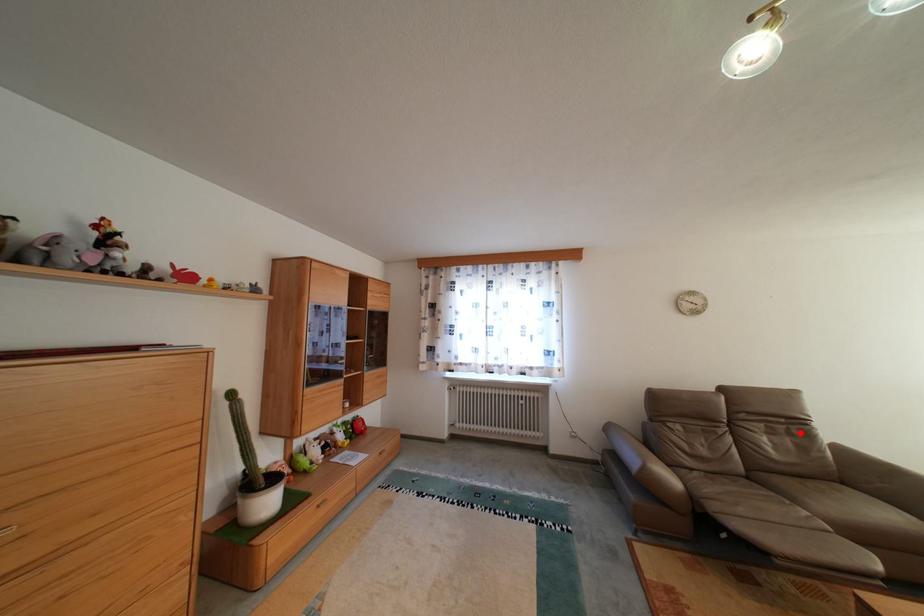
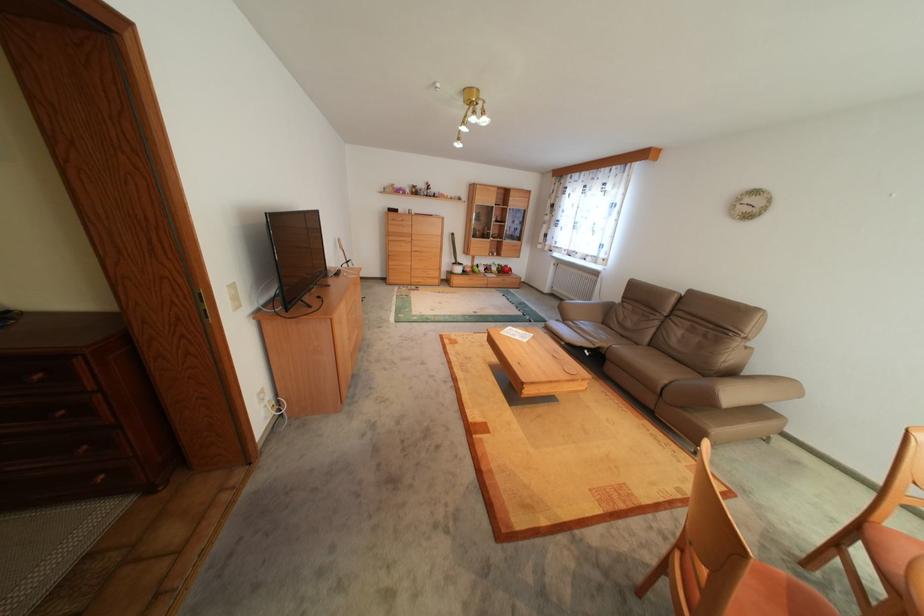
Locate, in the second image, the point that corresponds to the highlighted location in the first image.

(715, 334)